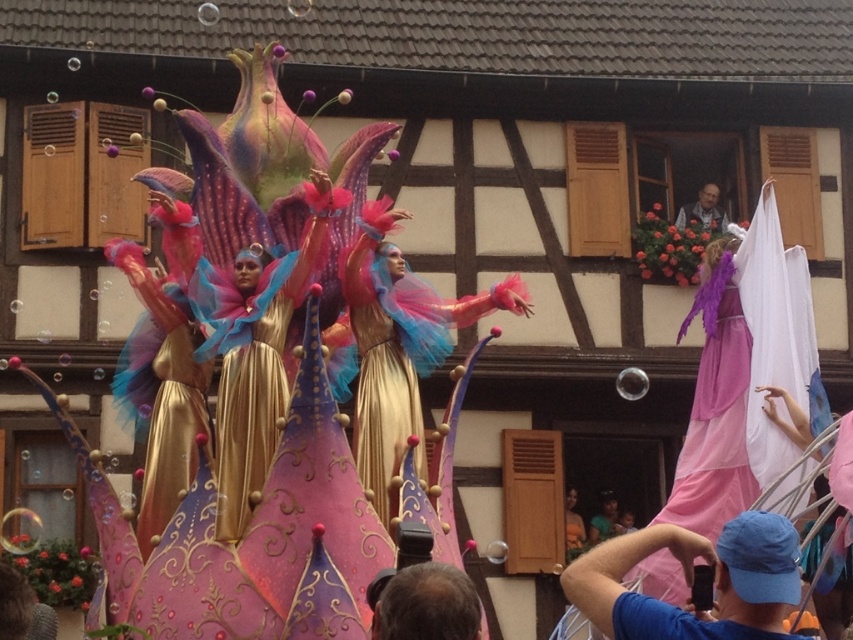
How far apart are blue fabric cap at lower right and pink satin dress at right?

blue fabric cap at lower right is 34.74 feet away from pink satin dress at right.

Is blue fabric cap at lower right wider than pink satin dress at right?

Yes, blue fabric cap at lower right is wider than pink satin dress at right.

Between point (659, 616) and point (720, 476), which one is positioned in front?

Point (659, 616)

This screenshot has height=640, width=853. In order to click on blue fabric cap at lower right in this screenshot , I will do pyautogui.click(x=692, y=580).

Can you confirm if shiny gold dress at center is bigger than smooth brown hair at lower center?

Indeed, shiny gold dress at center has a larger size compared to smooth brown hair at lower center.

Is shiny gold dress at center behind smooth brown hair at lower center?

That is True.

Locate an element on the screen. The width and height of the screenshot is (853, 640). shiny gold dress at center is located at coordinates (398, 340).

Does blue fabric cap at lower right have a lesser width compared to smooth brown hair at lower center?

Incorrect, blue fabric cap at lower right's width is not less than smooth brown hair at lower center's.

Between point (735, 584) and point (415, 596), which one is positioned in front?

Positioned in front is point (415, 596).

This screenshot has width=853, height=640. Identify the location of blue fabric cap at lower right. (692, 580).